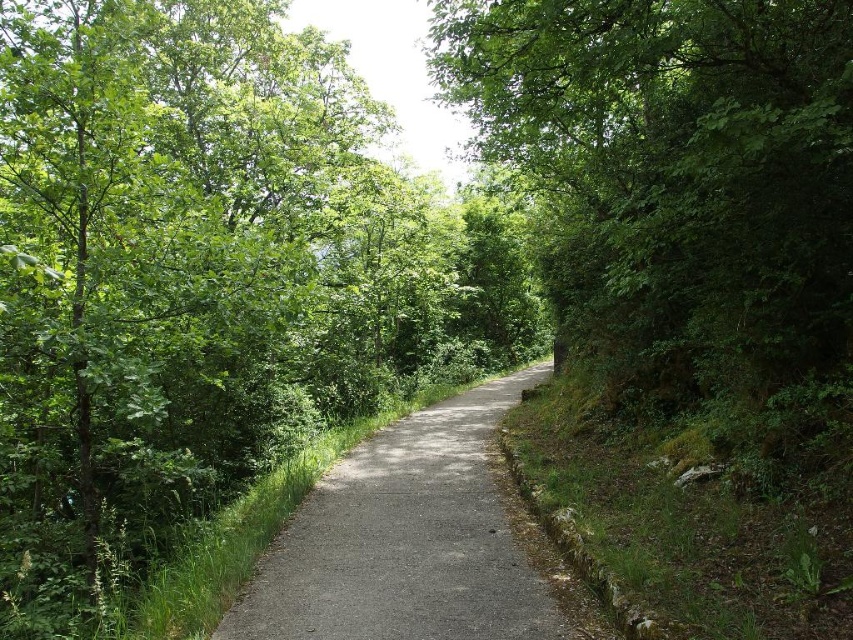
You are a hiker walking along the gray asphalt trail at center. You want to take a photo of the green leafy tree at center. Which direction should you turn to face the tree?

The green leafy tree at center is to the right of the gray asphalt trail at center, so you should turn to your right to face the tree.

You are hiking along the gray asphalt trail at center and want to take a photo of the green leafy tree at center. Since the tree is blocking your view, can you step to the right or left to get a clear shot?

The green leafy tree at center is in front of the gray asphalt trail at center, so stepping to the left would allow you to take a photo of the green leafy tree at center without obstruction from the trail.

You are a hiker carrying a 2m long telescope. You want to walk along the gray asphalt trail at center while keeping the telescope upright. Is the height of the green leafy tree at center sufficient to avoid hitting the telescope?

The green leafy tree at center is taller than the gray asphalt trail at center, so the telescope might hit the tree branches if held upright while walking along the trail. The tree is taller, so its branches could obstruct the telescope.